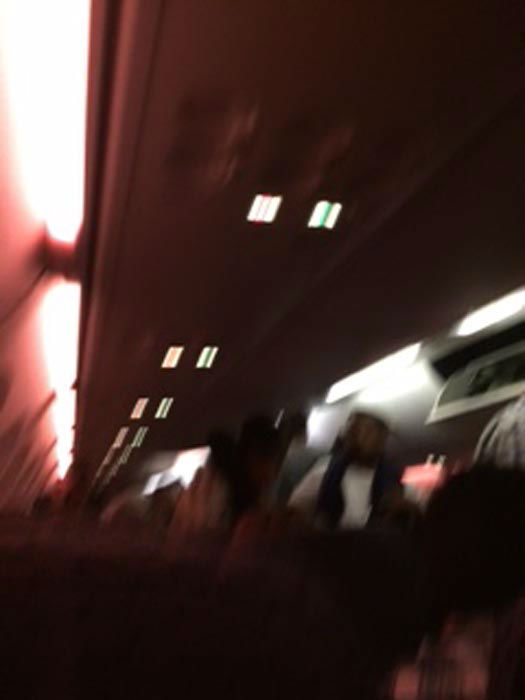
Locate an element on the screen. This screenshot has height=700, width=525. light is located at coordinates (166, 391).